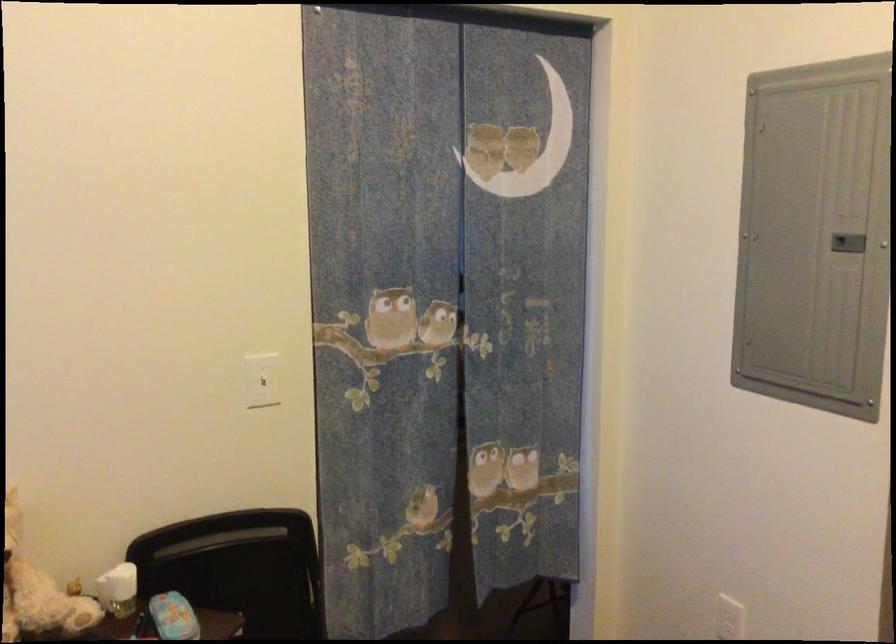
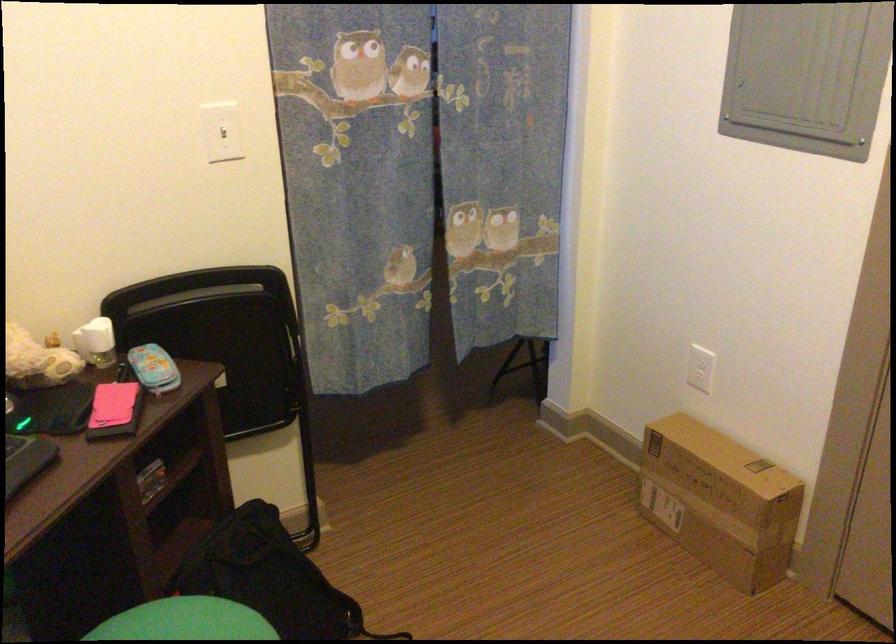
The point at (262, 381) is marked in the first image. Where is the corresponding point in the second image?

(222, 131)